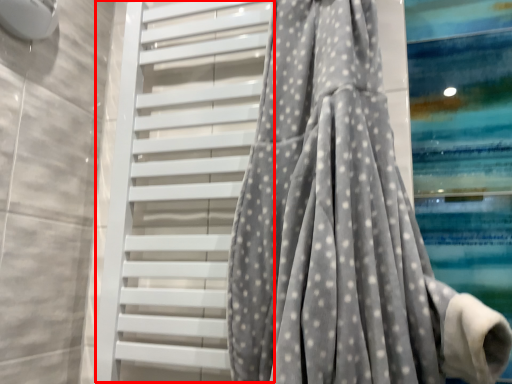
Question: In this image, where is shutter (annotated by the red box) located relative to curtain?

Choices:
 (A) left
 (B) right

Answer: (A)